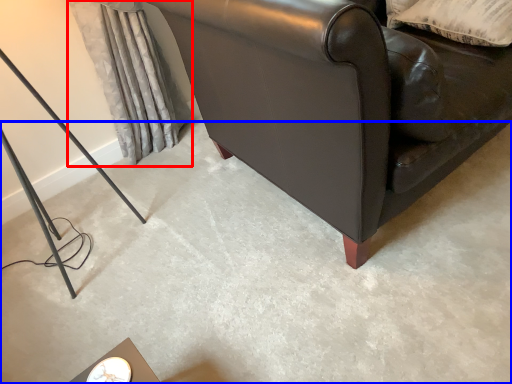
Question: Which point is closer to the camera, curtain (highlighted by a red box) or concrete (highlighted by a blue box)?

Choices:
 (A) curtain
 (B) concrete

Answer: (B)